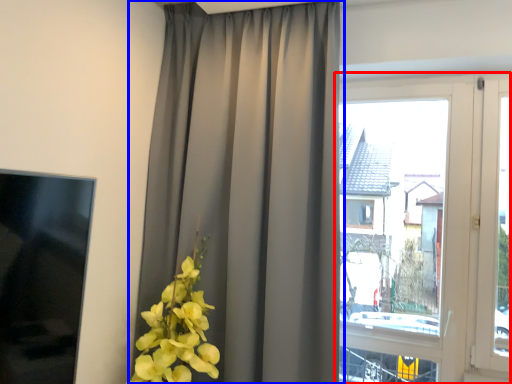
Question: Which point is closer to the camera, window (highlighted by a red box) or curtain (highlighted by a blue box)?

Choices:
 (A) window
 (B) curtain

Answer: (B)